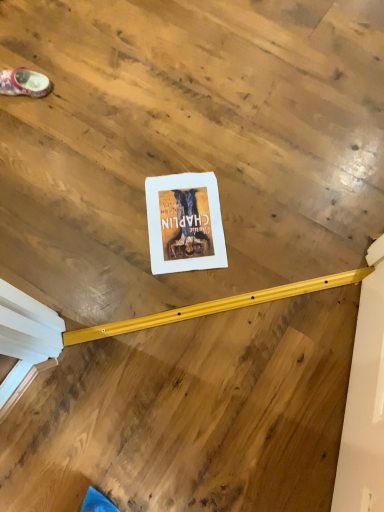
Locate an element on the screen. Image resolution: width=384 pixels, height=512 pixels. free space that is to the left of white paper at center is located at coordinates (106, 225).